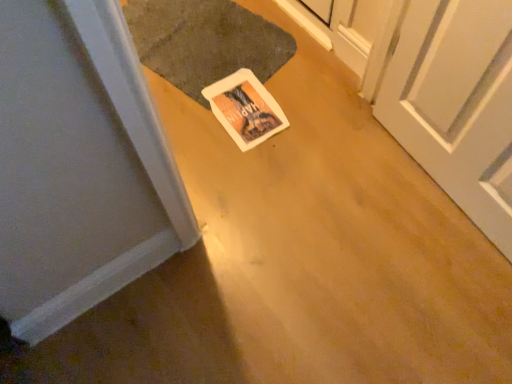
Locate an element on the screen. free space to the left of white paper postcard at center is located at coordinates (188, 107).